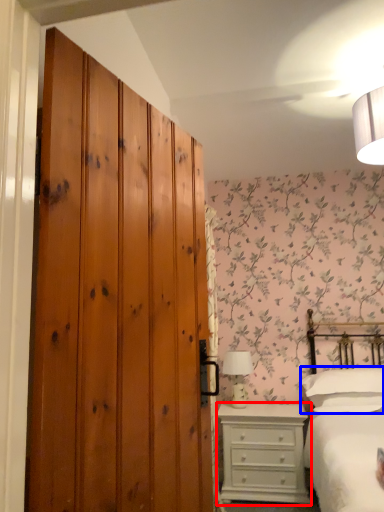
Question: Which object is closer to the camera taking this photo, chest of drawers (highlighted by a red box) or pillow (highlighted by a blue box)?

Choices:
 (A) chest of drawers
 (B) pillow

Answer: (B)